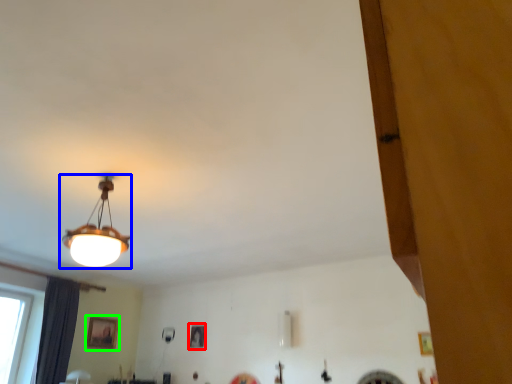
Question: Considering the real-world distances, which object is closest to picture frame (highlighted by a red box)? lamp (highlighted by a blue box) or picture frame (highlighted by a green box).

Choices:
 (A) lamp
 (B) picture frame

Answer: (B)